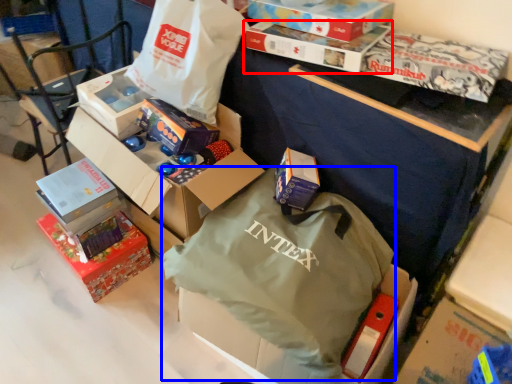
Question: Which object is closer to the camera taking this photo, box (highlighted by a red box) or bag (highlighted by a blue box)?

Choices:
 (A) box
 (B) bag

Answer: (B)